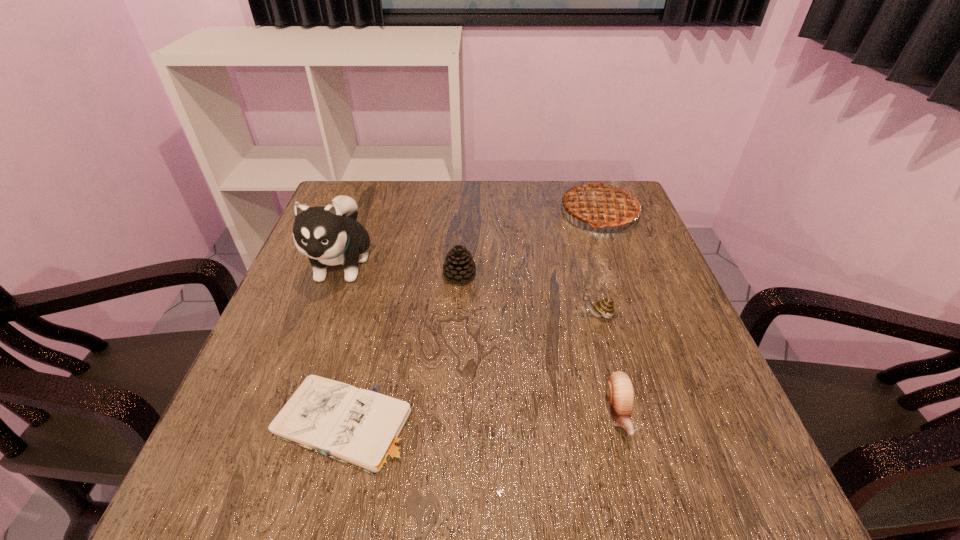
Identify the location of the closest object to the fifth shortest object. (605, 307).

Locate an element on the screen. This screenshot has width=960, height=540. free space that satisfies the following two spatial constraints: 1. at the face of the shortest object; 2. on the right side of the tallest object is located at coordinates (284, 423).

What are the coordinates of `free spot that satisfies the following two spatial constraints: 1. at the face of the notebook; 2. on the left side of the puppy` in the screenshot? It's located at (284, 423).

Locate an element on the screen. The height and width of the screenshot is (540, 960). free space in the image that satisfies the following two spatial constraints: 1. at the narrow end of the fourth object from right to left; 2. on the front side of the notebook is located at coordinates (452, 423).

The height and width of the screenshot is (540, 960). Identify the location of free spot that satisfies the following two spatial constraints: 1. on the back side of the fifth shortest object; 2. on the right side of the shortest object. (395, 213).